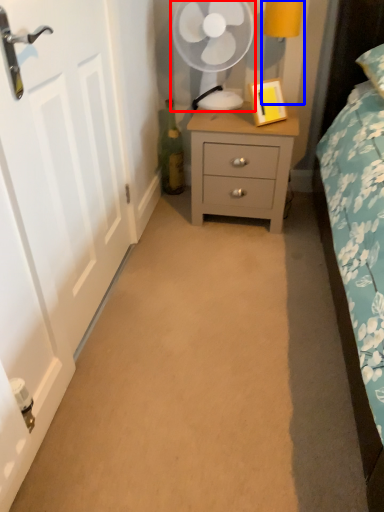
Question: Which point is closer to the camera, mechanical fan (highlighted by a red box) or bedside lamp (highlighted by a blue box)?

Choices:
 (A) mechanical fan
 (B) bedside lamp

Answer: (B)